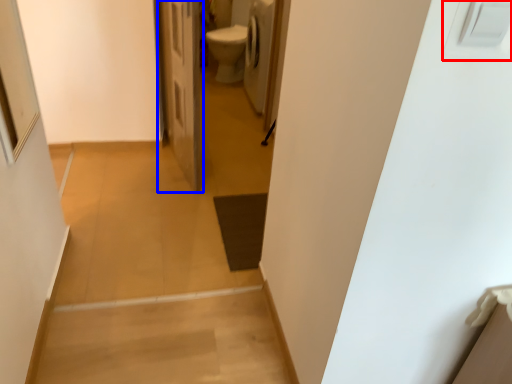
Question: Which of the following is the closest to the observer, electric outlet (highlighted by a red box) or door (highlighted by a blue box)?

Choices:
 (A) electric outlet
 (B) door

Answer: (A)